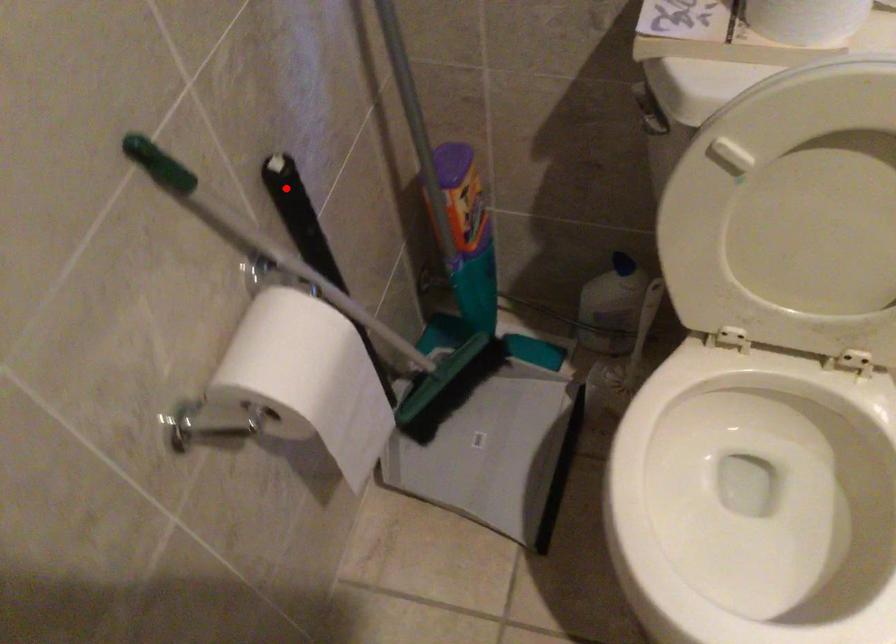
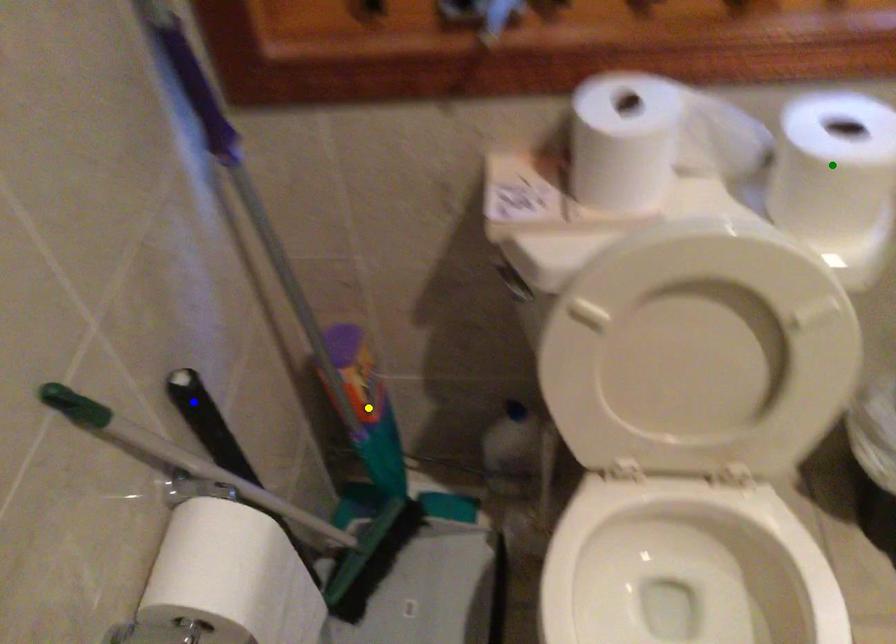
Question: I am providing you with two images of the same scene from different viewpoints. A red point is marked on the first image. You are given multiple points on the second image. Which mark in image 2 goes with the point in image 1?

Choices:
 (A) green point
 (B) blue point
 (C) yellow point

Answer: (B)